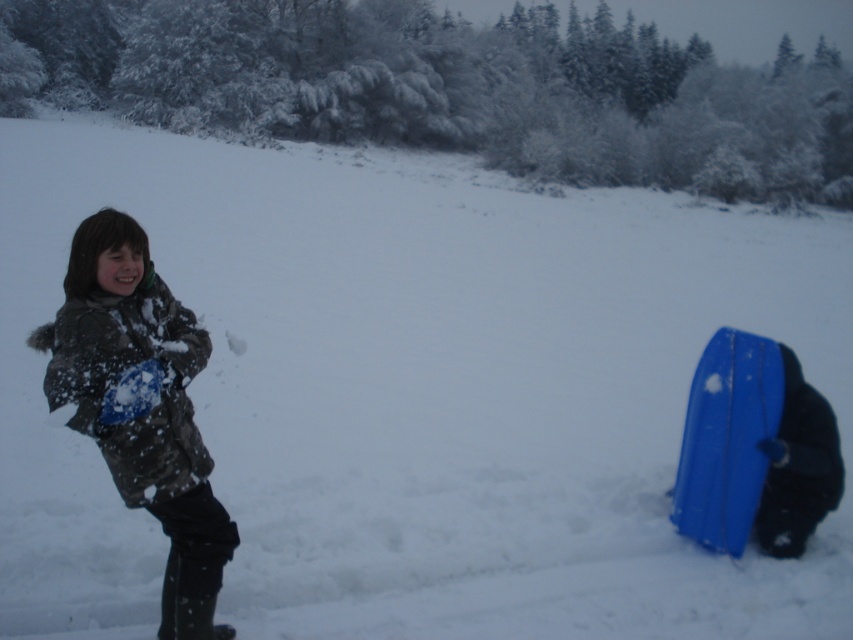
From the picture: Is snow-covered jacket at left to the right of blue plastic snowboard at lower right from the viewer's perspective?

In fact, snow-covered jacket at left is to the left of blue plastic snowboard at lower right.

Is point (132, 444) positioned behind point (728, 448)?

No.

Is point (200, 608) in front of point (712, 410)?

Yes, it is in front of point (712, 410).

Where is `snow-covered jacket at left`? This screenshot has height=640, width=853. snow-covered jacket at left is located at coordinates (141, 406).